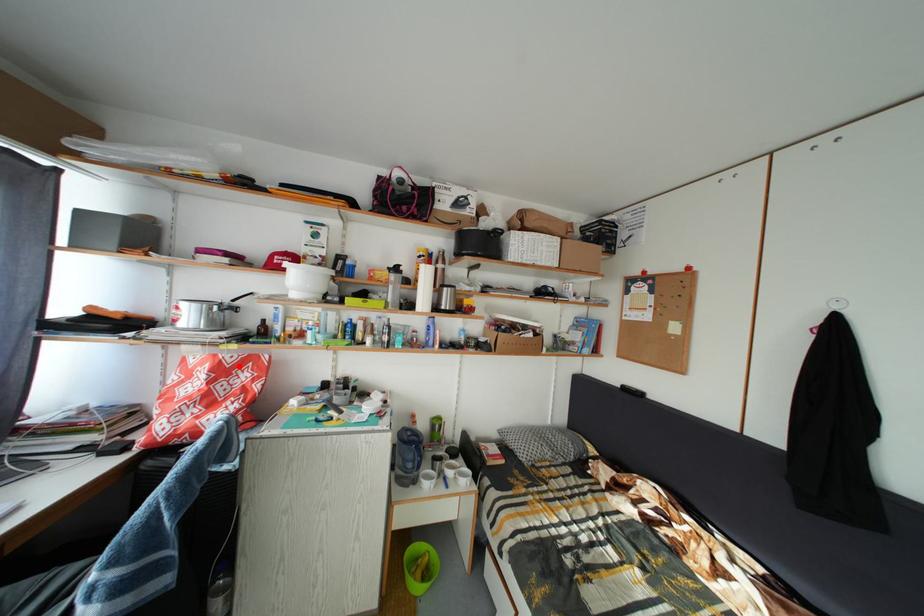
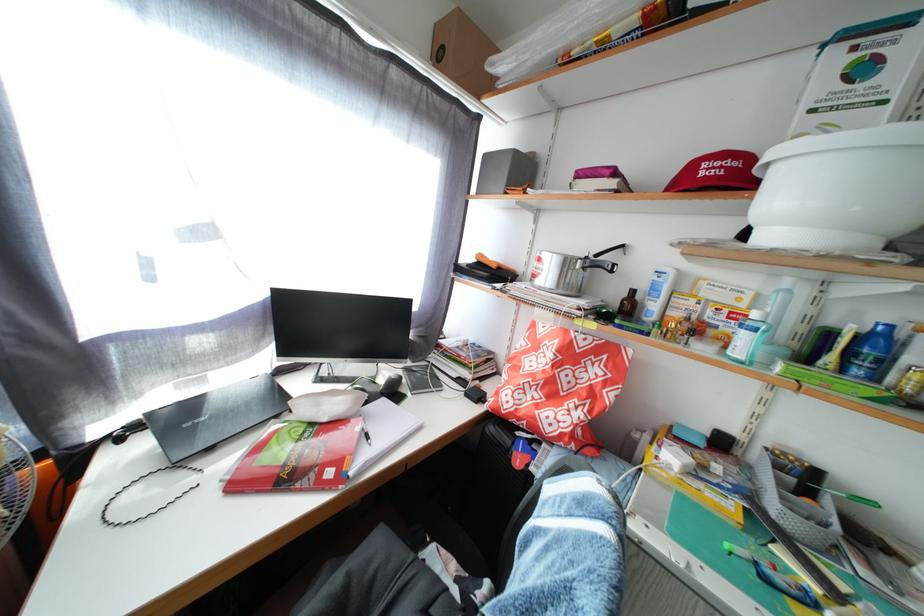
Where in the second image is the point corresponding to the highlighted location from the first image?

(590, 350)